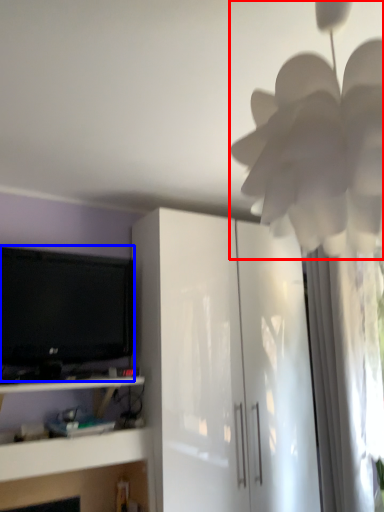
Question: Which object is further to the camera taking this photo, flower (highlighted by a red box) or television (highlighted by a blue box)?

Choices:
 (A) flower
 (B) television

Answer: (B)